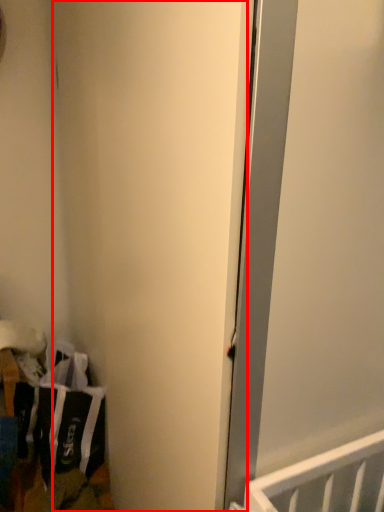
Question: From the image's perspective, where is door (annotated by the red box) located in relation to laundry in the image?

Choices:
 (A) above
 (B) below

Answer: (A)